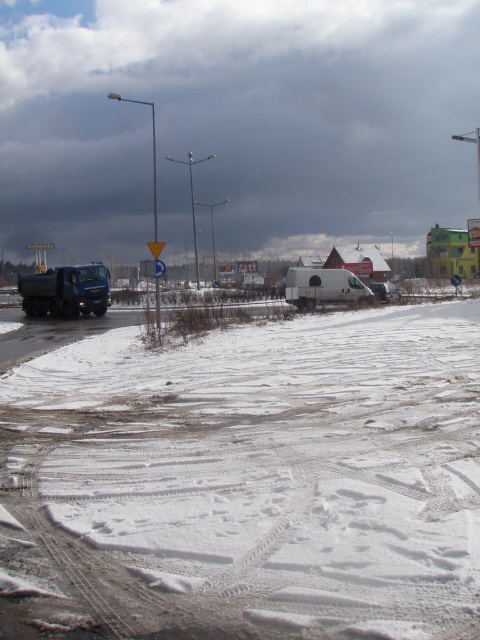
Question: Which of the following is the closest to the observer?

Choices:
 (A) matte black truck at left
 (B) white matte van at center
 (C) white powdery snow at lower left

Answer: (C)

Question: Can you confirm if white powdery snow at lower left is smaller than white matte van at center?

Choices:
 (A) no
 (B) yes

Answer: (A)

Question: Is white powdery snow at lower left above matte black truck at left?

Choices:
 (A) yes
 (B) no

Answer: (B)

Question: Which point is closer to the camera?

Choices:
 (A) matte black truck at left
 (B) white matte van at center
 (C) white powdery snow at lower left

Answer: (C)

Question: In this image, where is white powdery snow at lower left located relative to matte black truck at left?

Choices:
 (A) left
 (B) right

Answer: (B)

Question: Which point is farther to the camera?

Choices:
 (A) (27, 307)
 (B) (388, 294)

Answer: (A)